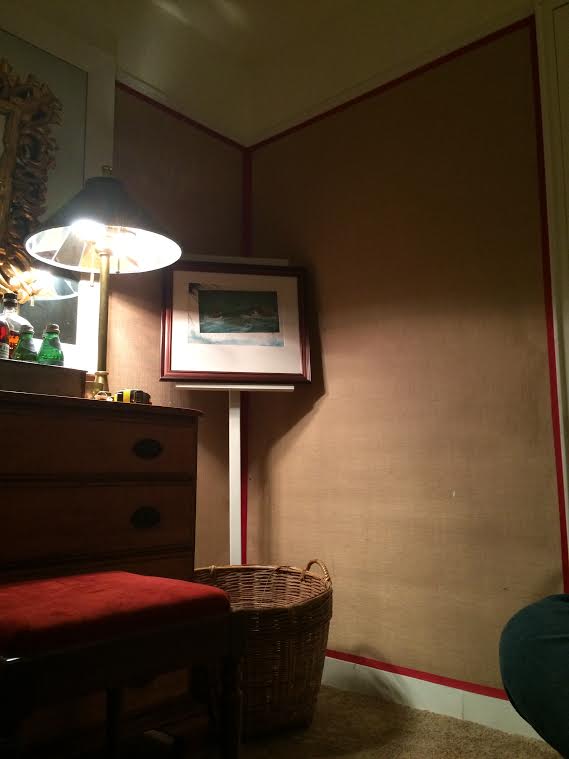
You are a GUI agent. You are given a task and a screenshot of the screen. Output one action in this format:
    pyautogui.click(x=<x>, y=<y>)
    Task: Click on the green bird on a shelf
    The height and width of the screenshot is (759, 569).
    Given the screenshot: What is the action you would take?
    pyautogui.click(x=48, y=354)